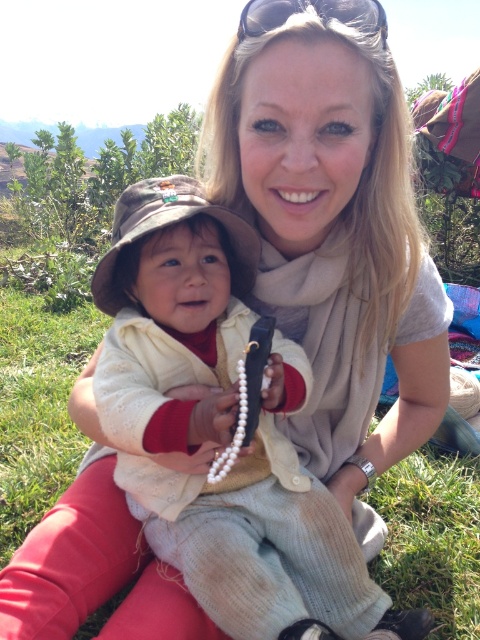
You are a fashion designer observing the scene. You need to determine the placement of the knitted beige sweater at center and the black plastic sunglasses at upper center for a catalog layout. According to the image, which item is placed to the left of the other?

The knitted beige sweater at center is positioned on the left side of black plastic sunglasses at upper center.

You are an interior designer planning to place a new sofa in a living room. The sofa must be positioned at the same coordinates as the knitted beige sweater at center. What are the coordinates where you should place the sofa?

The knitted beige sweater at center is located at coordinates point (219,428), so you should place the sofa at those coordinates.